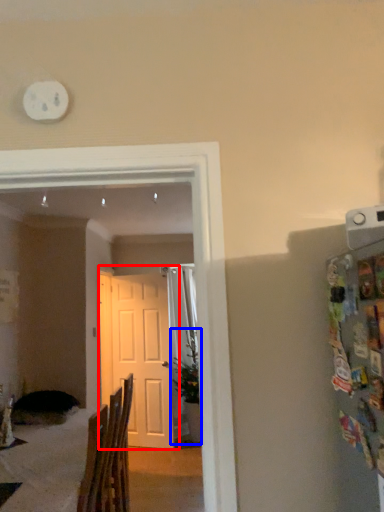
Question: Among these objects, which one is farthest to the camera, door (highlighted by a red box) or houseplant (highlighted by a blue box)?

Choices:
 (A) door
 (B) houseplant

Answer: (B)